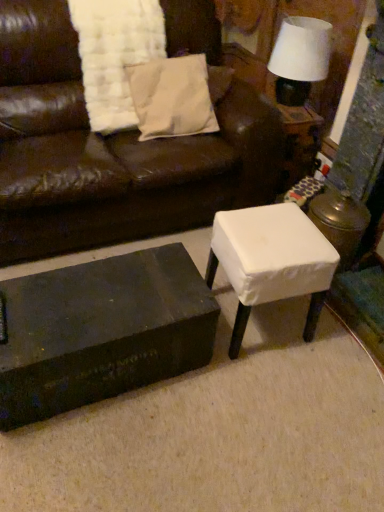
I want to click on free location in front of white fabric stool at center, so click(x=264, y=392).